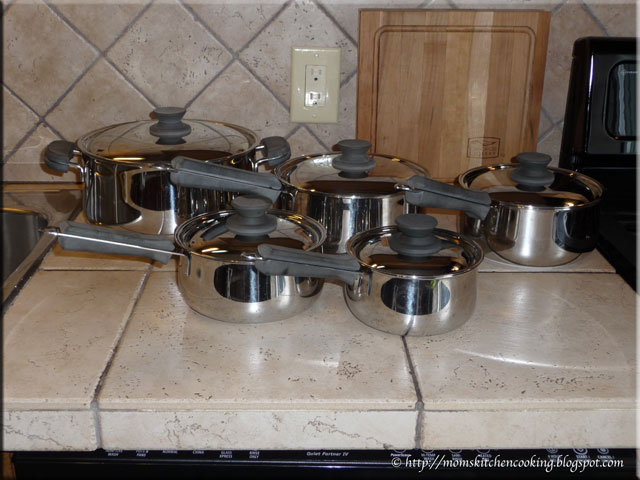
Locate an element on the screen. The width and height of the screenshot is (640, 480). back splash is located at coordinates (166, 44).